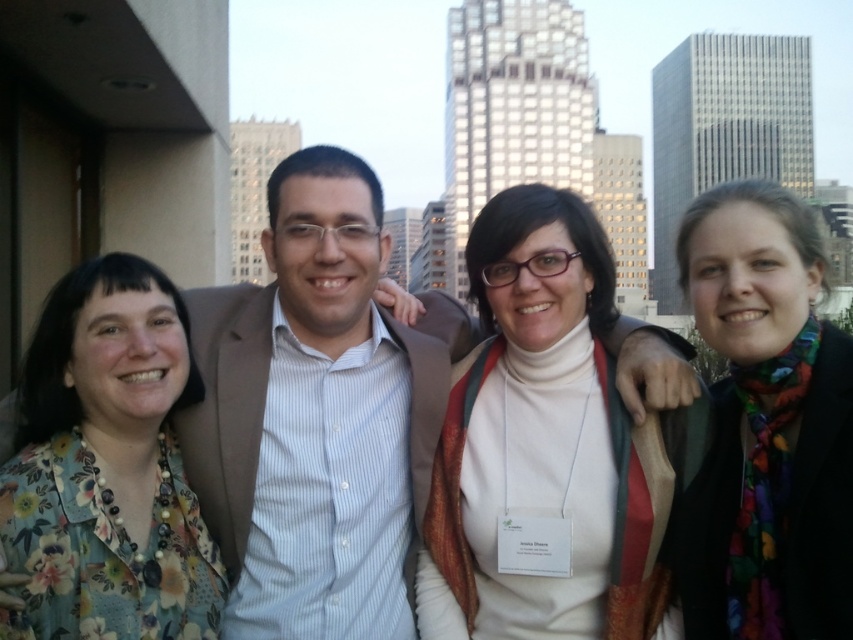
You are standing at the point labeled as point (152,545) and want to see the point labeled as point (556,292). Can you see it without moving your position?

Point (556,292) is behind point (152,545), so you cannot see it from your current position.

You are a photographer trying to capture a photo of the matte brown suit at center and the multicolored scarf at right. Based on their positions, which object should you focus on first if you want to capture both in a single frame without moving the camera?

The matte brown suit at center is to the left of the multicolored scarf at right, so you should focus on the matte brown suit at center first to ensure both are in frame.

You are a photographer trying to capture a closeup of the white turtleneck sweater at center and the floral print blouse at left. Which one should you focus on first if you want to ensure both are in focus without moving the camera?

The white turtleneck sweater at center is located above the floral print blouse at left, so you should focus on the white turtleneck sweater at center first to ensure both are in focus.